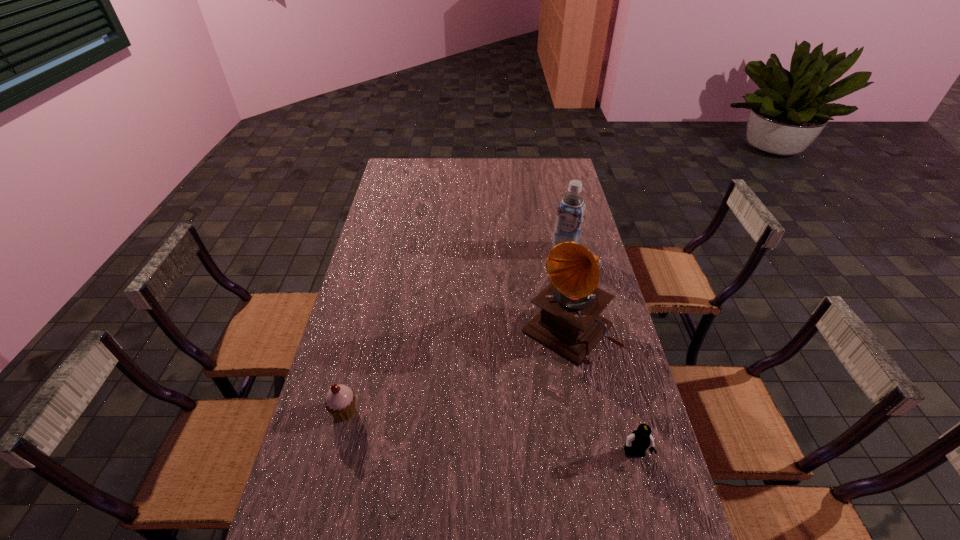
In order to click on free space located on the label of the farthest object in this screenshot , I will do `click(525, 327)`.

Where is `vacant position located on the label of the farthest object`? This screenshot has height=540, width=960. vacant position located on the label of the farthest object is located at coordinates point(537,305).

I want to click on free space located 0.120m on the horn of the phonograph record, so click(517, 383).

Identify the location of free location located on the horn of the phonograph record. (507, 394).

This screenshot has width=960, height=540. Find the location of `blank space located 0.330m on the horn of the phonograph record`. blank space located 0.330m on the horn of the phonograph record is located at coordinates click(470, 435).

Find the location of a particular element. object at the left edge is located at coordinates (340, 402).

The height and width of the screenshot is (540, 960). Identify the location of Lego present at the right edge. (639, 440).

Where is `soya milk that is at the right edge`? The width and height of the screenshot is (960, 540). soya milk that is at the right edge is located at coordinates (570, 215).

The width and height of the screenshot is (960, 540). I want to click on phonograph record that is positioned at the right edge, so click(569, 322).

Find the location of a particular element. This screenshot has height=540, width=960. free space at the far edge is located at coordinates (511, 163).